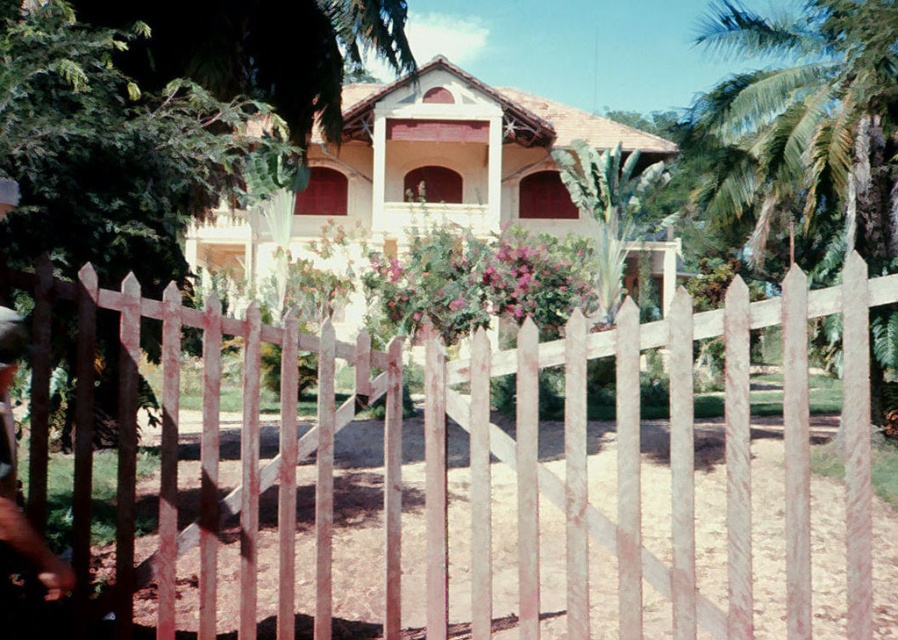
Which is above, white wooden picket fence at center or green leafy palm tree at center?

green leafy palm tree at center is above.

Is white wooden picket fence at center positioned before green leafy palm tree at center?

That is True.

Locate an element on the screen. The height and width of the screenshot is (640, 898). white wooden picket fence at center is located at coordinates (668, 460).

I want to click on white wooden picket fence at center, so click(x=668, y=460).